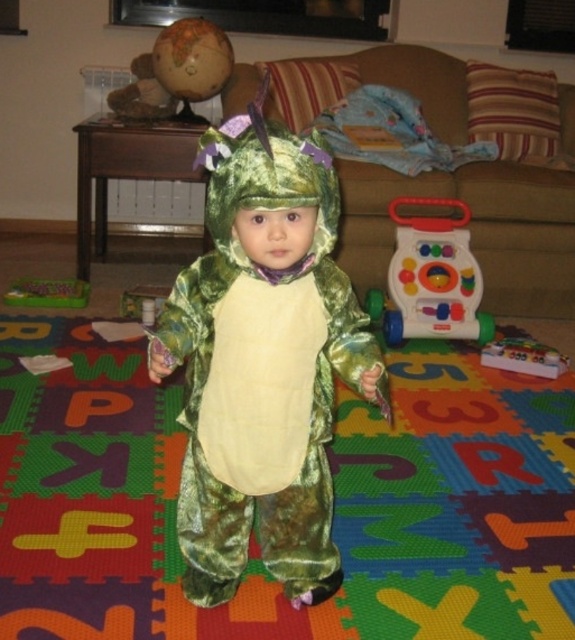
Does velvet green costume at center lie in front of multicolored plastic walker at center?

Yes, it is in front of multicolored plastic walker at center.

Which is behind, point (325, 516) or point (408, 282)?

The point (408, 282) is behind.

What are the coordinates of `velvet green costume at center` in the screenshot? It's located at (262, 364).

Locate an element on the screen. This screenshot has width=575, height=640. velvet green costume at center is located at coordinates (262, 364).

Who is higher up, multicolored plastic toy at lower right or green plastic toy at lower left?

Positioned higher is green plastic toy at lower left.

Which is in front, point (523, 346) or point (36, 284)?

Point (523, 346) is more forward.

This screenshot has height=640, width=575. Identify the location of multicolored plastic toy at lower right. (523, 356).

Can you confirm if multicolored plastic walker at center is bigger than multicolored plastic toy at lower right?

Yes, multicolored plastic walker at center is bigger than multicolored plastic toy at lower right.

Who is positioned more to the left, multicolored plastic walker at center or multicolored plastic toy at lower right?

From the viewer's perspective, multicolored plastic walker at center appears more on the left side.

Which is in front, point (448, 250) or point (553, 376)?

Point (553, 376) is in front.

Find the location of a particular element. multicolored plastic walker at center is located at coordinates (434, 276).